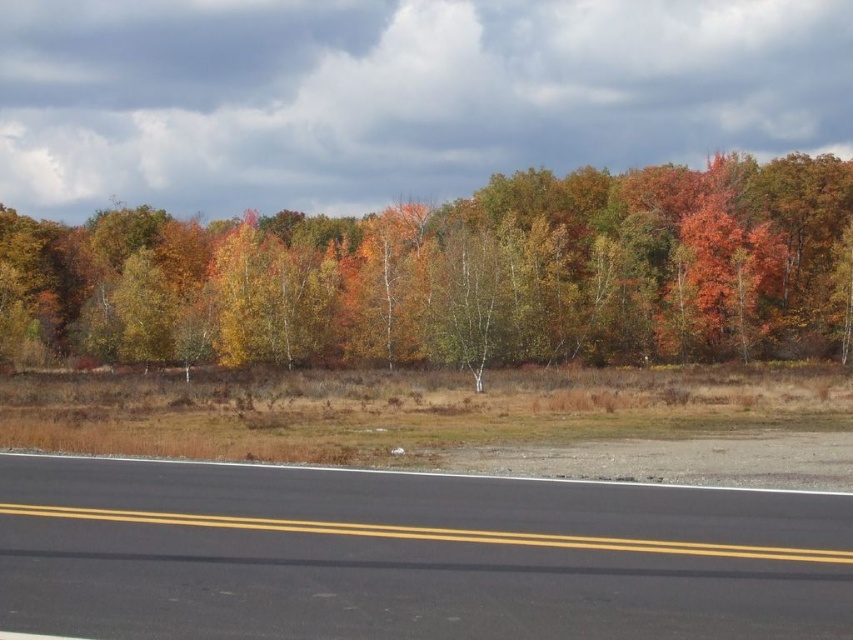
Consider the image. You are a photographer standing at the edge of the road, aiming to capture a photo that includes both the autumn leaves at upper center and the double yellow lines on the road. Given that your camera has a maximum focus range of 50 meters, will you be able to clearly capture both elements in the same photo?

The autumn leaves at upper center are 54.79 meters away from the camera, which exceeds the camera maximum focus range of 50 meters. Therefore, the autumn leaves at upper center will be out of focus, making it impossible to clearly capture both elements in the same photo.

You are standing at the edge of the road in the image and want to reach a specific point marked as point [822,252]. Given that you can walk at a speed of 1.5 meters per second, how long will it take you to reach that point?

The distance between you and point [822,252] is 86.58 meters. At a walking speed of 1.5 meters per second, it would take approximately 57.72 seconds to reach the point.